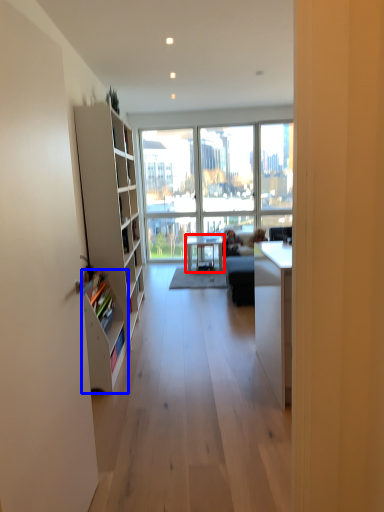
Question: Which point is further to the camera, table (highlighted by a red box) or shelf (highlighted by a blue box)?

Choices:
 (A) table
 (B) shelf

Answer: (A)